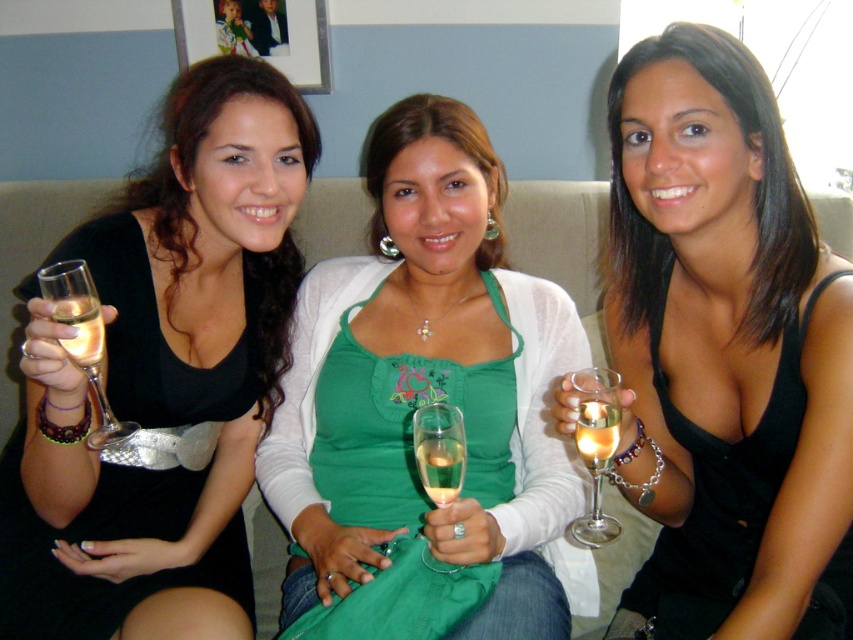
You are taking a photo of two points in the image. The first point is at coordinates point (508,369) and the second point is at point (82,307). Which point is closer to the camera?

Point (508,369) is further to the camera than point (82,307), so the second point is closer to the camera.

You are a bartender who needs to place a coaster under the translucent glass flute at center and the translucent glass champagne at center. Which object requires a larger coaster to cover its base?

The translucent glass flute at center requires a larger coaster because its width is greater than that of the translucent glass champagne at center.

You are a photographer setting up for a group photo. You need to ensure that the clear glass wine glass at left and the green fabric dress at center are both visible in the frame. Based on their positions, which object is closer to the camera?

The green fabric dress at center is closer to the camera because the clear glass wine glass at left is behind it.